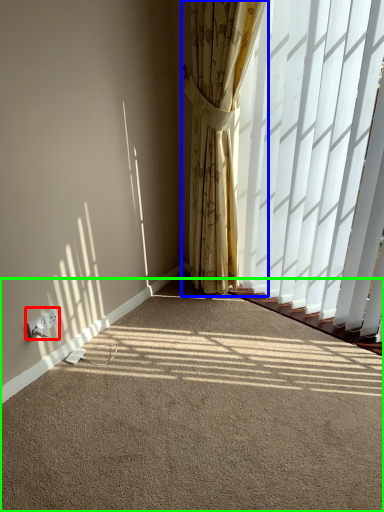
Question: Which object is positioned closest to electric outlet (highlighted by a red box)? Select from curtain (highlighted by a blue box) and plain (highlighted by a green box).

Choices:
 (A) curtain
 (B) plain

Answer: (B)